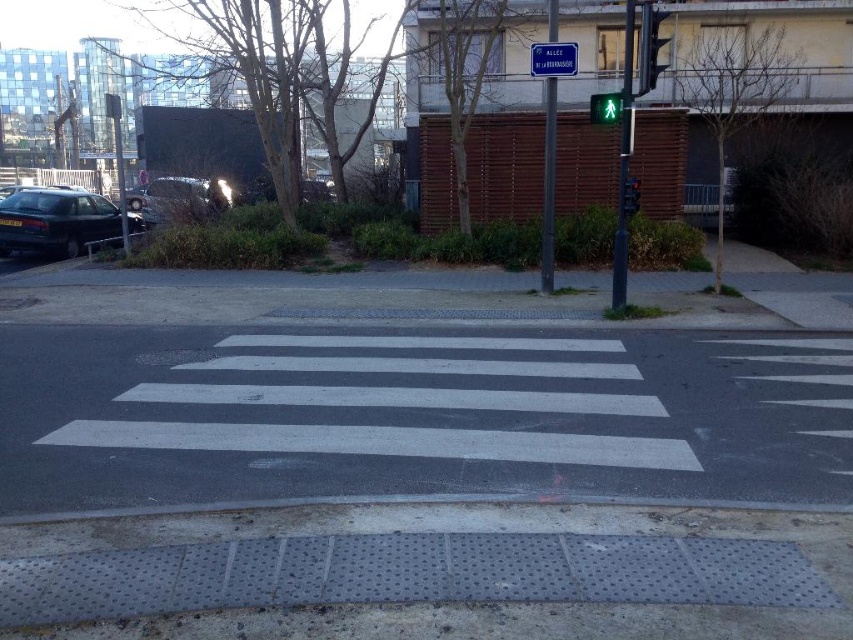
Question: Which point appears farthest from the camera in this image?

Choices:
 (A) 635,177
 (B) 543,56

Answer: (A)

Question: Estimate the real-world distances between objects in this image. Which object is closer to the green glass pedestrian signal at upper center?

Choices:
 (A) blue plastic sign at upper center
 (B) shiny black car at left
 (C) metallic traffic light at upper right

Answer: (C)

Question: Can you confirm if shiny silver car at left is positioned below blue plastic sign at upper center?

Choices:
 (A) yes
 (B) no

Answer: (A)

Question: Does shiny black car at left come behind shiny silver car at left?

Choices:
 (A) yes
 (B) no

Answer: (B)

Question: Does metallic traffic light at upper right appear on the right side of metallic traffic light at center right?

Choices:
 (A) yes
 (B) no

Answer: (A)

Question: Which of the following is the farthest from the observer?

Choices:
 (A) shiny silver car at left
 (B) metallic traffic light at upper right
 (C) shiny black car at left

Answer: (A)